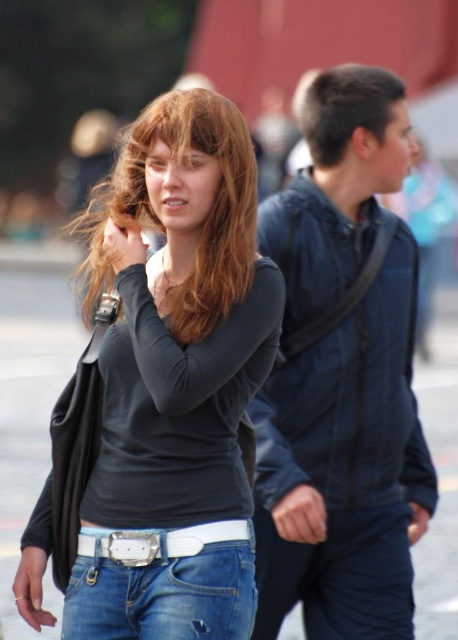
Does point (376, 449) come in front of point (185, 611)?

No, (376, 449) is further to viewer.

The width and height of the screenshot is (458, 640). What do you see at coordinates (342, 378) in the screenshot? I see `dark blue jacket at center` at bounding box center [342, 378].

Locate an element on the screen. The width and height of the screenshot is (458, 640). dark blue jacket at center is located at coordinates click(342, 378).

Is point (158, 598) closer to camera compared to point (189, 554)?

Yes, point (158, 598) is in front of point (189, 554).

Between point (167, 605) and point (82, 531), which one is positioned behind?

The point (82, 531) is more distant.

The image size is (458, 640). Describe the element at coordinates (163, 584) in the screenshot. I see `denim jeans at lower center` at that location.

Find the location of a particular element. The height and width of the screenshot is (640, 458). denim jeans at lower center is located at coordinates (163, 584).

Which of these two, matte black shirt at center or white matte belt at lower center, stands taller?

matte black shirt at center

Between matte black shirt at center and white matte belt at lower center, which one appears on the left side from the viewer's perspective?

matte black shirt at center is more to the left.

Where is `matte black shirt at center`? The height and width of the screenshot is (640, 458). matte black shirt at center is located at coordinates (x=164, y=392).

This screenshot has height=640, width=458. I want to click on matte black shirt at center, so click(x=164, y=392).